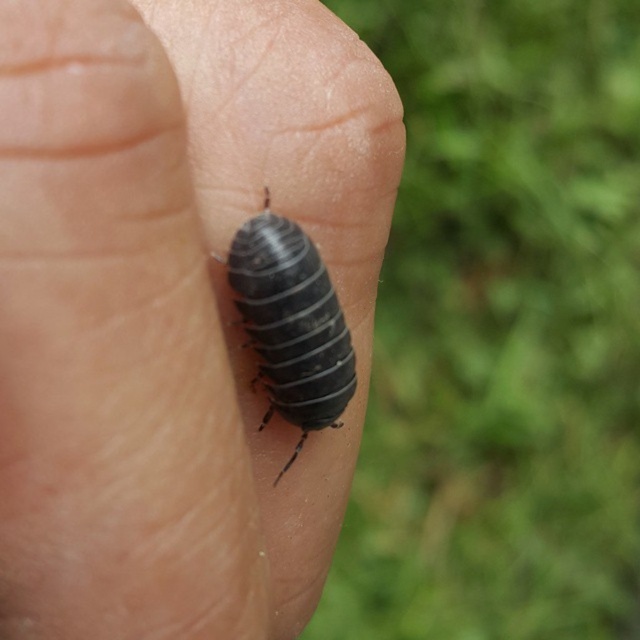
You are a photographer aiming to capture a closeup of the matte black bug at center. The camera is currently focused on the tip of the finger. To ensure the bug is in focus, should you adjust the focus to the left or right of the current position?

The matte black bug at center is located at point [172,307] in 2D coordinates. Since the camera is focused on the tip of the finger, which is likely further away than the bug, adjusting the focus closer to the bug would bring it into focus. However, based on the coordinates, the bug is slightly to the right and down from the center. To focus on it, move the focus point to the right from the current position.

You are a nature photographer trying to capture a closeup of the matte black bug at center and the shiny black beetle at center. Since you want to focus on both insects equally, which one might require adjusting the camera focus to ensure it doesn not get blurry due to their size difference?

The matte black bug at center has a greater height compared to the shiny black beetle at center. Therefore, you should adjust the camera focus to account for the larger size of the matte black bug at center to ensure both are in focus.